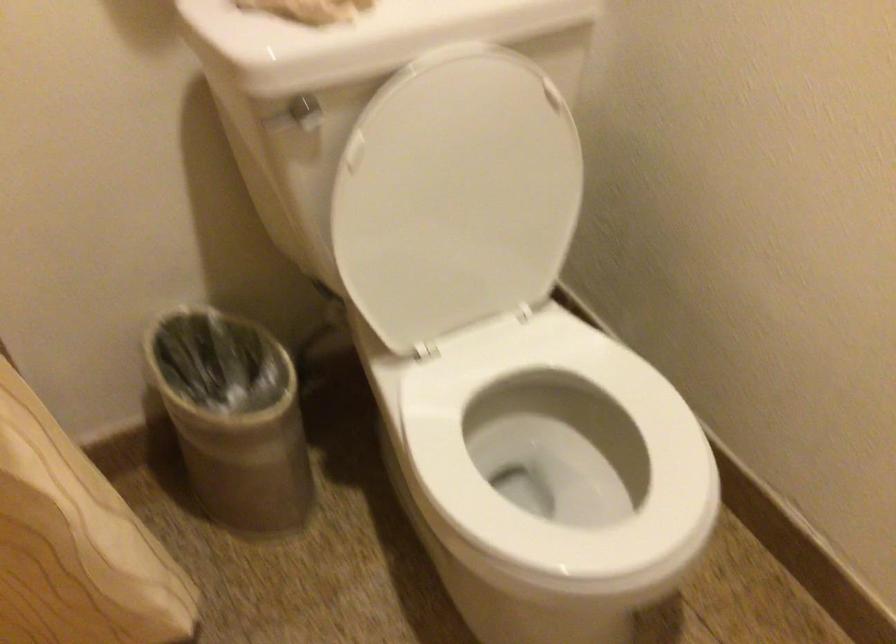
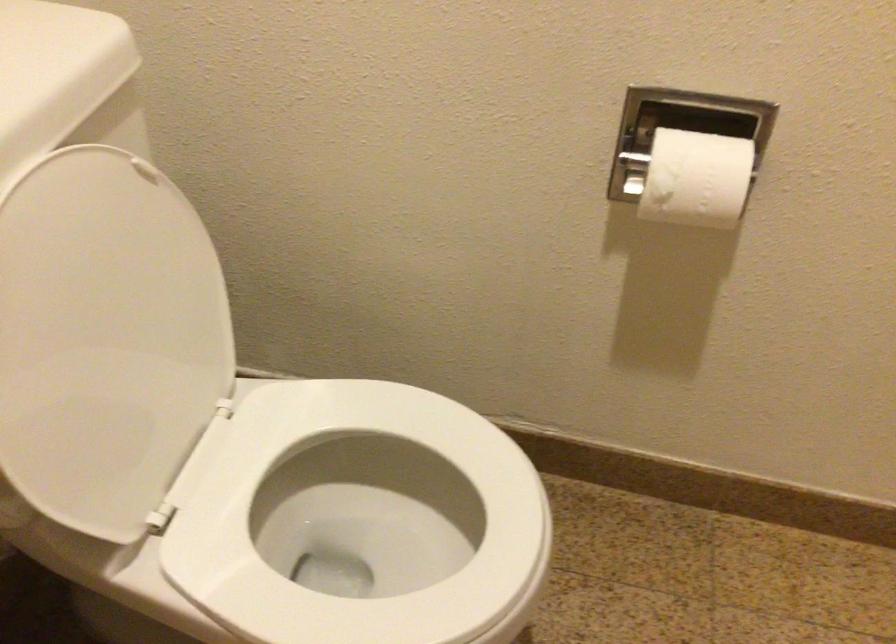
Question: The camera is either moving clockwise (left) or counter-clockwise (right) around the object. The first image is from the beginning of the video and the second image is from the end. Is the camera moving left or right when shooting the video?

Choices:
 (A) Left
 (B) Right

Answer: (A)